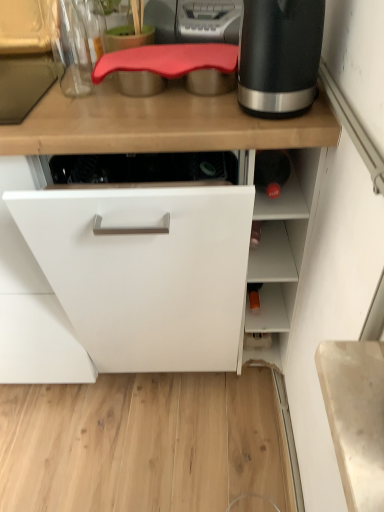
Identify the location of blank space to the left of black matte electric kettle at upper right. (192, 120).